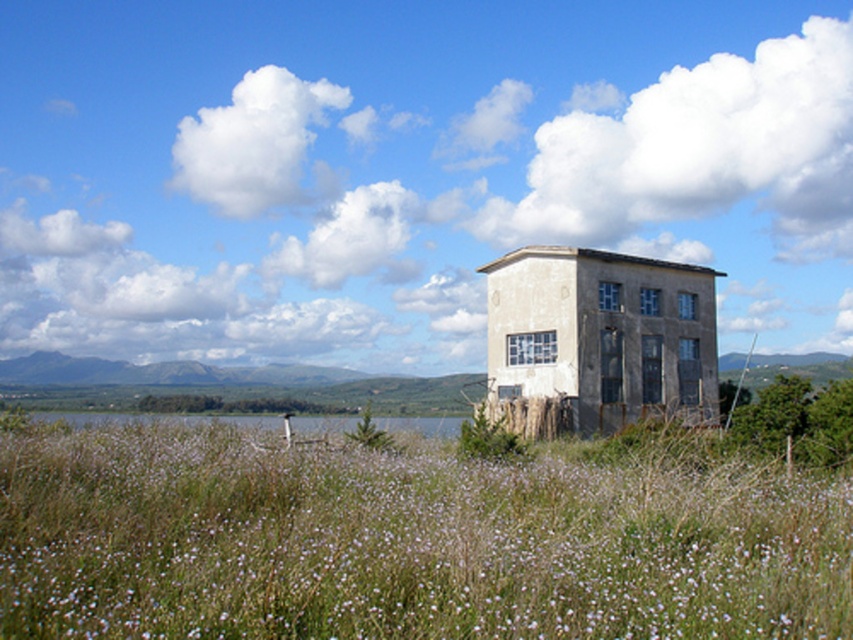
Question: Among these points, which one is nearest to the camera?

Choices:
 (A) (9, 477)
 (B) (447, 426)

Answer: (A)

Question: Observing the image, what is the correct spatial positioning of green grass at center in reference to green grass at lower center?

Choices:
 (A) left
 (B) right

Answer: (B)

Question: Does green grass at center appear on the right side of green grass at lower center?

Choices:
 (A) no
 (B) yes

Answer: (B)

Question: Which point is farther to the camera?

Choices:
 (A) (119, 467)
 (B) (402, 420)

Answer: (B)

Question: Considering the relative positions of green grass at center and green grass at lower center in the image provided, where is green grass at center located with respect to green grass at lower center?

Choices:
 (A) right
 (B) left

Answer: (A)